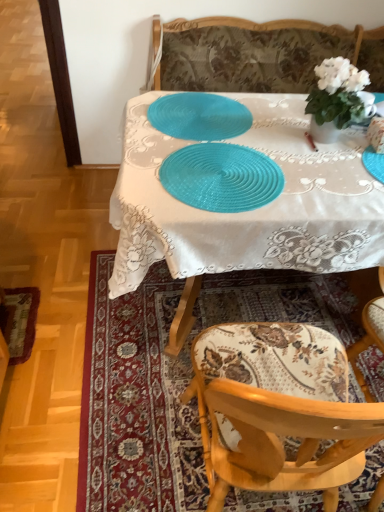
I want to click on free space to the left of wooden chair at lower right, so click(x=46, y=309).